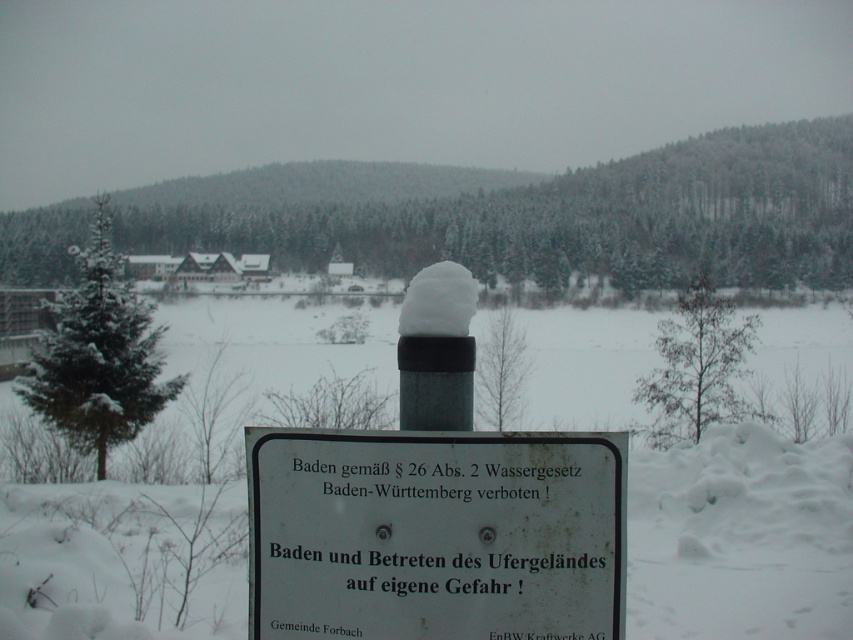
From the picture: You are a hiker who wants to read the warning sign in the snow. Can you easily read the text on the white plastic sign at center if it is covered by the white fluffy snow at center?

The white plastic sign at center is positioned under the white fluffy snow at center, meaning the snow is covering it. This would make it difficult to read the text on the sign.

You are standing at the camera position looking at the snowy landscape. There are two points marked in the image, one at coordinates point (268, 550) and another at point (450, 262). Which point is nearer to you?

Point (268, 550) is closer to the camera than point (450, 262).